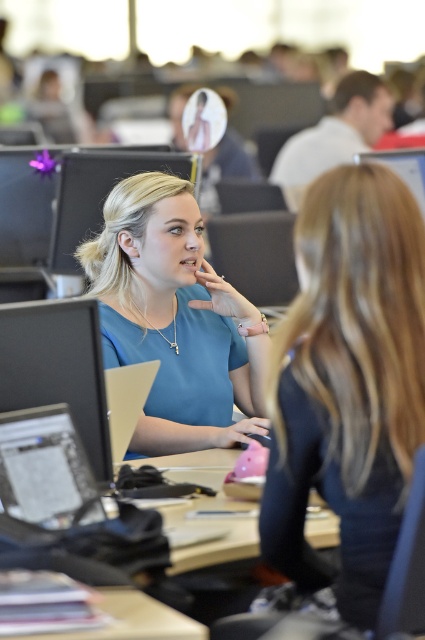
Question: Is black matte shirt at center to the left of blue fabric shirt at center from the viewer's perspective?

Choices:
 (A) no
 (B) yes

Answer: (A)

Question: Which of these objects is positioned closest to the matte black monitor at left?

Choices:
 (A) blue fabric shirt at center
 (B) black matte shirt at center

Answer: (B)

Question: Is black matte shirt at center wider than blue fabric shirt at center?

Choices:
 (A) no
 (B) yes

Answer: (A)

Question: Is black matte shirt at center positioned behind blue fabric shirt at center?

Choices:
 (A) yes
 (B) no

Answer: (B)

Question: Which point appears closest to the camera in this image?

Choices:
 (A) (39, 369)
 (B) (135, 218)
 (C) (373, 189)

Answer: (C)

Question: Which point appears closest to the camera in this image?

Choices:
 (A) (144, 440)
 (B) (79, 412)

Answer: (B)